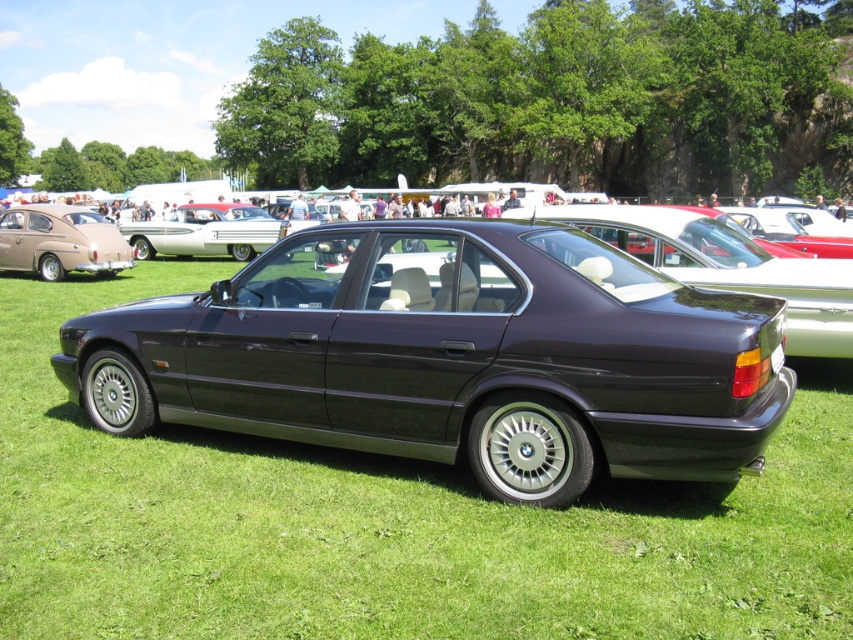
Who is shorter, satin dark blue sedan at center or matte brown car at left?

satin dark blue sedan at center

Is satin dark blue sedan at center further to camera compared to matte brown car at left?

No, it is in front of matte brown car at left.

Is point (641, 236) positioned after point (39, 243)?

No, (641, 236) is closer to viewer.

Locate an element on the screen. The image size is (853, 640). satin dark blue sedan at center is located at coordinates (724, 266).

Can you confirm if satin dark gray car at center is taller than matte brown car at left?

In fact, satin dark gray car at center may be shorter than matte brown car at left.

Is satin dark gray car at center thinner than matte brown car at left?

Incorrect, satin dark gray car at center's width is not less than matte brown car at left's.

The image size is (853, 640). Describe the element at coordinates (451, 356) in the screenshot. I see `satin dark gray car at center` at that location.

Locate an element on the screen. This screenshot has width=853, height=640. satin dark gray car at center is located at coordinates coord(451,356).

Is satin dark blue sedan at center bigger than white glossy sedan at center?

Yes, satin dark blue sedan at center is bigger than white glossy sedan at center.

Can you confirm if satin dark blue sedan at center is shorter than white glossy sedan at center?

In fact, satin dark blue sedan at center may be taller than white glossy sedan at center.

Describe the element at coordinates (724, 266) in the screenshot. I see `satin dark blue sedan at center` at that location.

Find the location of a particular element. The height and width of the screenshot is (640, 853). satin dark blue sedan at center is located at coordinates [x=724, y=266].